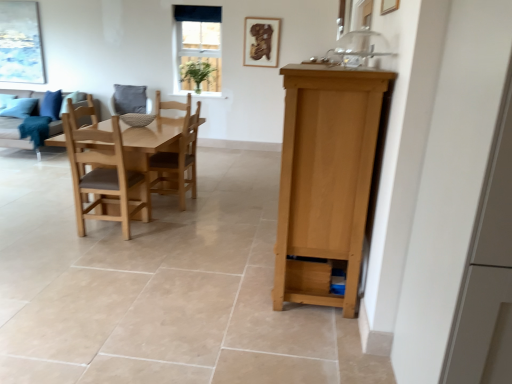
Question: Is matte gray fabric couch at left taller or shorter than light brown wooden table at center?

Choices:
 (A) short
 (B) tall

Answer: (A)

Question: In the image, is matte gray fabric couch at left positioned in front of or behind light brown wooden table at center?

Choices:
 (A) front
 (B) behind

Answer: (B)

Question: Based on their relative distances, which object is nearer to the gray fabric armchair at center?

Choices:
 (A) blue fabric pillow at left
 (B) white glass window at upper center
 (C) light brown wooden chair at center, the 1th chair positioned from the front
 (D) light brown wooden chair at center, arranged as the first chair when viewed from the back
 (E) wooden picture frame at upper center, placed as the 1th picture frame when sorted from front to back

Answer: (A)

Question: Considering the real-world distances, which object is closest to the light brown wooden chair at center, arranged as the first chair when viewed from the back?

Choices:
 (A) light brown wooden chair at center, the second chair positioned from the back
 (B) matte gray fabric couch at left
 (C) gray fabric armchair at center
 (D) matte blue painting at upper left, placed as the 2th picture frame when sorted from right to left
 (E) wooden picture frame at upper center, placed as the 1th picture frame when sorted from front to back

Answer: (A)